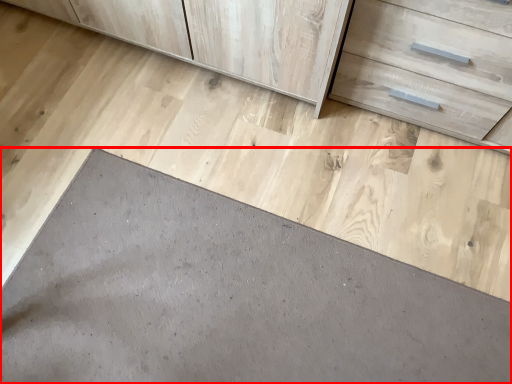
Question: Considering the relative positions of slate (annotated by the red box) and drawer in the image provided, where is slate (annotated by the red box) located with respect to the staircase?

Choices:
 (A) left
 (B) right

Answer: (A)